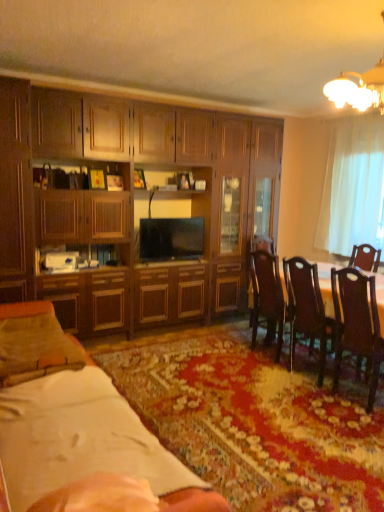
Find the location of a particular element. Image resolution: width=384 pixels, height=512 pixels. free space that is to the left of dark wood chair at right, acting as the 2th chair starting from the left is located at coordinates (308, 406).